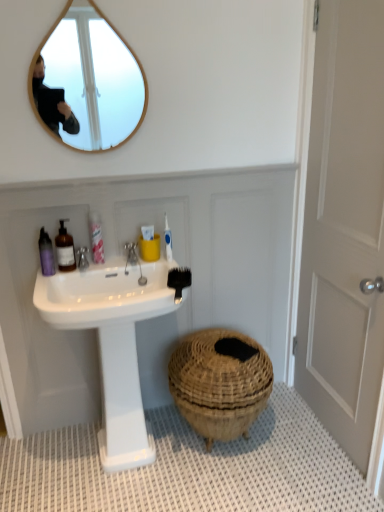
I want to click on vacant space in front of translucent glass soap dispenser at left, which ranks as the second toiletry in left-to-right order, so click(x=53, y=281).